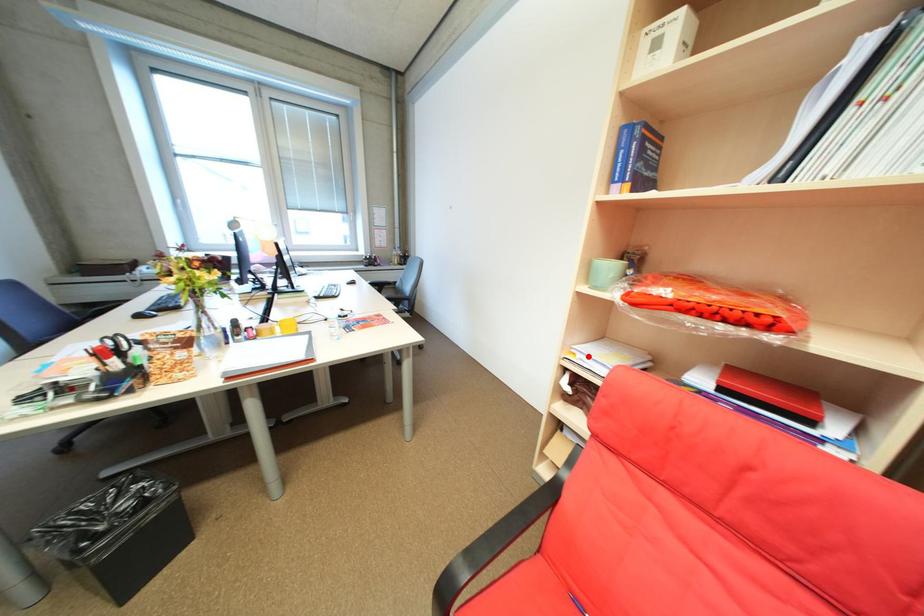
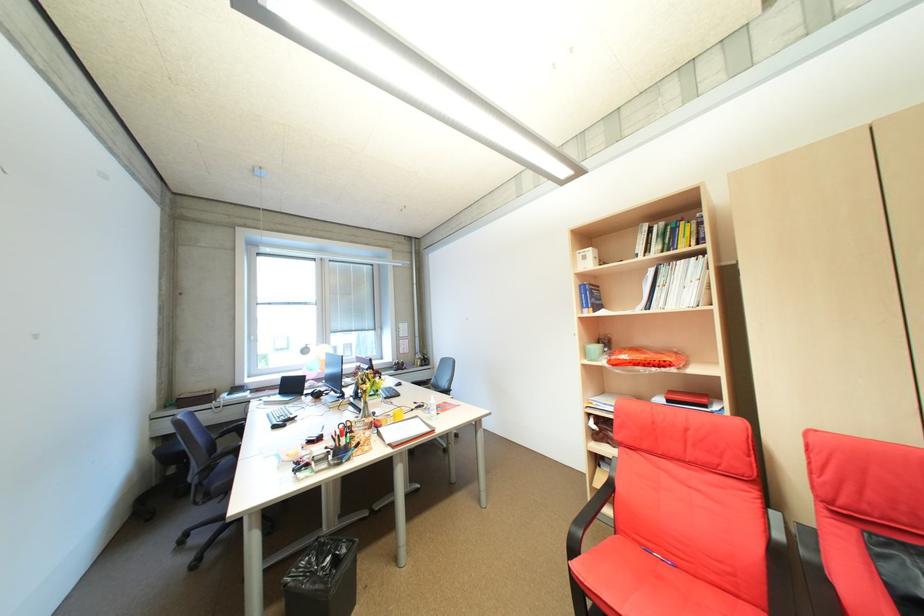
The point at the highlighted location is marked in the first image. Where is the corresponding point in the second image?

(603, 403)